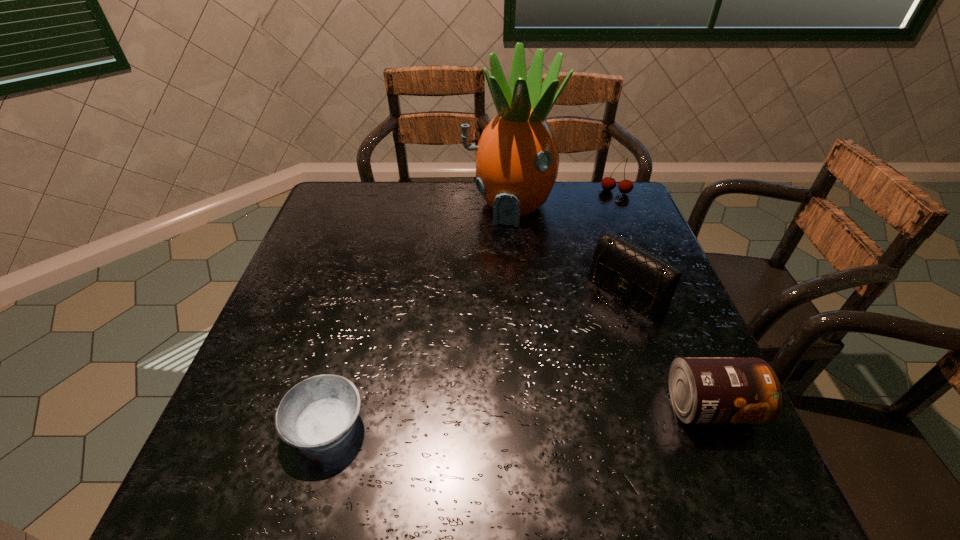
Where is `vacant space located 0.140m on the surface of the cherry`? vacant space located 0.140m on the surface of the cherry is located at coordinates (602, 221).

The width and height of the screenshot is (960, 540). Identify the location of vacant region located 0.240m on the front flap of the third nearest object. (533, 368).

You are a GUI agent. You are given a task and a screenshot of the screen. Output one action in this format:
    pyautogui.click(x=<x>, y=<y>)
    Task: Click on the vacant space located on the front flap of the third nearest object
    
    Given the screenshot: What is the action you would take?
    pyautogui.click(x=553, y=353)

Find the location of a particular element. free space located 0.050m on the front flap of the third nearest object is located at coordinates (591, 321).

The width and height of the screenshot is (960, 540). What are the coordinates of `free region located at the entrance of the fourth object from right to left` in the screenshot? It's located at (482, 335).

Locate an element on the screen. vacant space located 0.070m at the entrance of the fourth object from right to left is located at coordinates (500, 247).

In order to click on vacant space located 0.380m at the entrance of the fourth object from right to left in this screenshot , I will do `click(482, 335)`.

Find the location of a particular element. cherry present at the far edge is located at coordinates 625,186.

Locate an element on the screen. The width and height of the screenshot is (960, 540). pineapple that is positioned at the far edge is located at coordinates point(517,159).

Where is `ashtray situated at the near edge`? The image size is (960, 540). ashtray situated at the near edge is located at coordinates (318, 413).